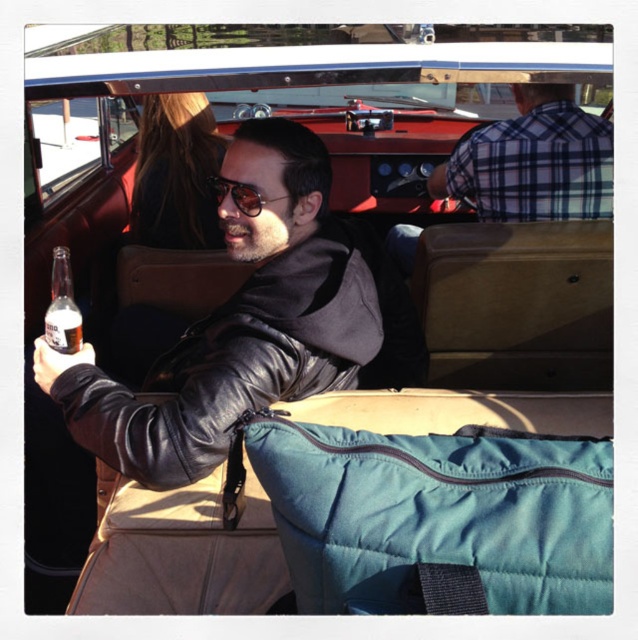
You are a tailor who needs to determine which clothing item requires more fabric to make between the leather jacket at center and the plaid shirt at upper right. Which one would you choose?

The leather jacket at center is larger in size than the plaid shirt at upper right, so the leather jacket at center would require more fabric to make.

You are standing at the point labeled point [82,321] in the car. You want to reach the door handle to exit. The door handle is located 1.5 meters away from the camera. Can you reach it without moving from your current position?

The point labeled point [82,321] is 1.39 meters away from the camera. Since the door handle is 1.5 meters away from the camera, the distance between the point and the door handle is approximately 0.11 meters. Therefore, you can likely reach the door handle without moving from your current position.